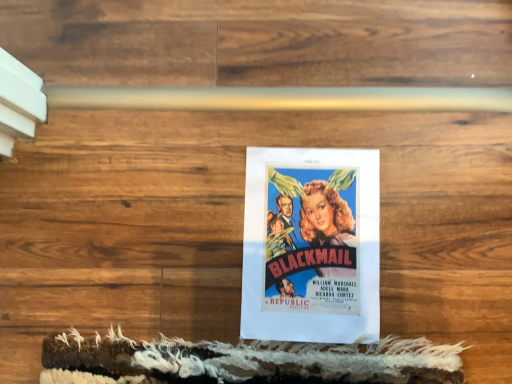
Question: Should I look upward or downward to see matte paper poster at center?

Choices:
 (A) down
 (B) up

Answer: (A)